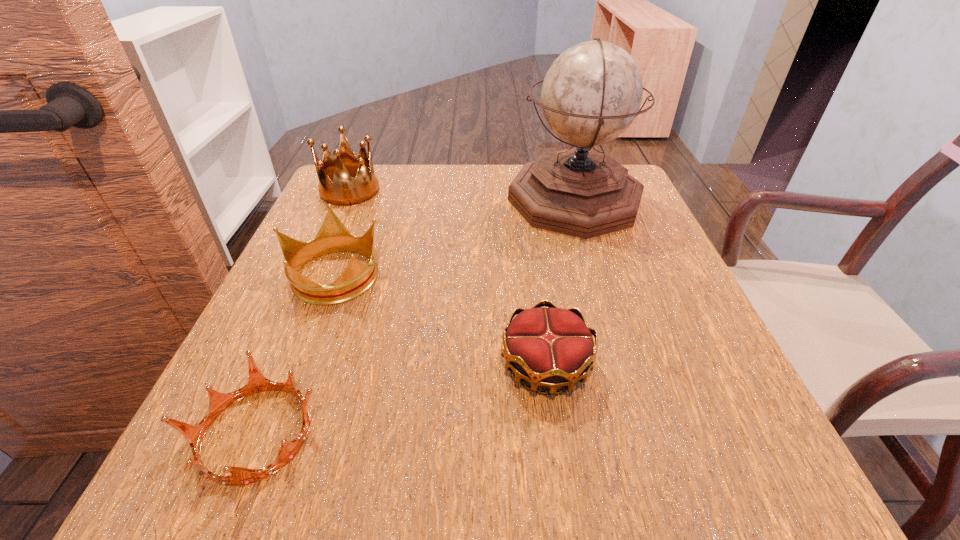
Find the location of a particular element. The height and width of the screenshot is (540, 960). vacant area located 0.170m on the front of the third farthest object is located at coordinates (290, 388).

Locate an element on the screen. Image resolution: width=960 pixels, height=540 pixels. vacant space situated 0.220m on the left of the rightmost crown is located at coordinates (360, 364).

Where is `globe present at the far edge`? This screenshot has height=540, width=960. globe present at the far edge is located at coordinates (591, 94).

This screenshot has height=540, width=960. In order to click on crown that is at the far edge in this screenshot , I will do `click(336, 186)`.

Where is `object located at the near edge`? The image size is (960, 540). object located at the near edge is located at coordinates (218, 402).

Locate an element on the screen. object that is at the right edge is located at coordinates (591, 94).

Where is `object at the far left corner`? This screenshot has height=540, width=960. object at the far left corner is located at coordinates (336, 186).

This screenshot has width=960, height=540. I want to click on object situated at the near left corner, so click(218, 402).

Where is `object situated at the far right corner`? This screenshot has width=960, height=540. object situated at the far right corner is located at coordinates (591, 94).

This screenshot has height=540, width=960. In the image, there is a desktop. Find the location of `free space at the far edge`. free space at the far edge is located at coordinates (495, 168).